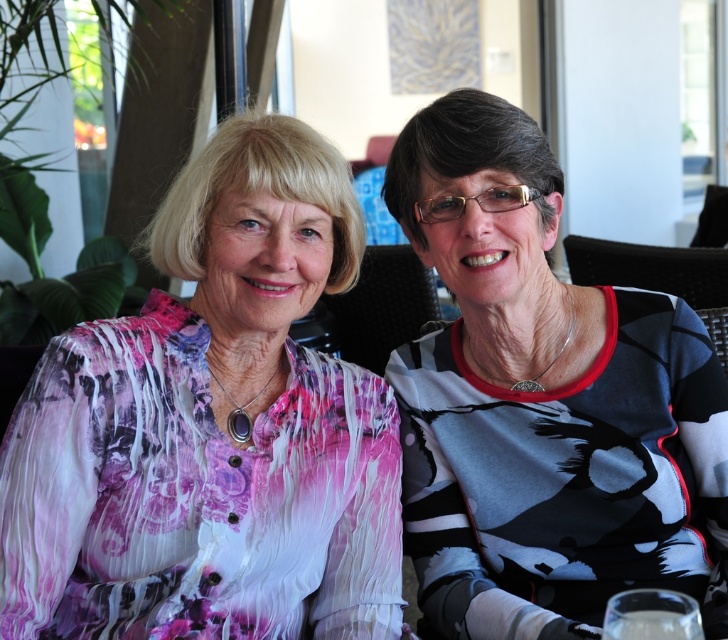
Question: Which of the following is the closest to the observer?

Choices:
 (A) black and white printed shirt at right
 (B) pink floral blouse at left

Answer: (B)

Question: In this image, where is pink floral blouse at left located relative to black and white printed shirt at right?

Choices:
 (A) left
 (B) right

Answer: (A)

Question: Can you confirm if pink floral blouse at left is thinner than black and white printed shirt at right?

Choices:
 (A) yes
 (B) no

Answer: (B)

Question: Is pink floral blouse at left to the left of black and white printed shirt at right from the viewer's perspective?

Choices:
 (A) no
 (B) yes

Answer: (B)

Question: Which point is farther to the camera?

Choices:
 (A) (539, 284)
 (B) (114, 467)

Answer: (A)